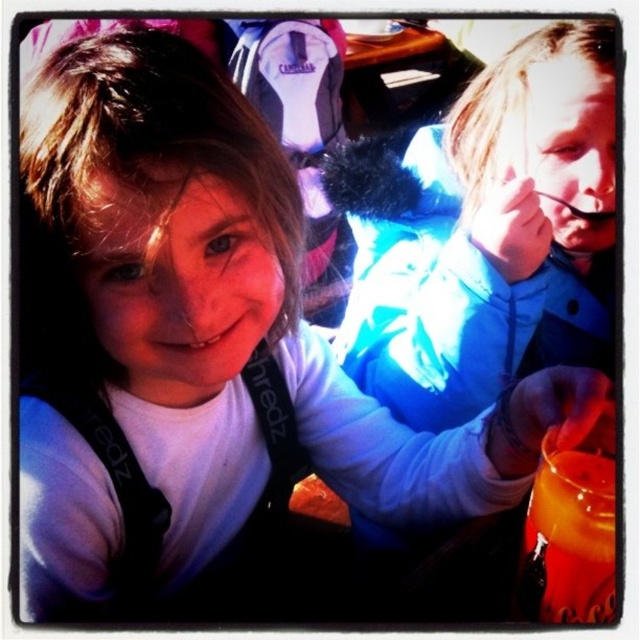
You are a photographer trying to capture a candid shot of the two children in the scene. You notice the blue softshell jacket at upper right and the orange liquid at lower right. Which object is positioned to the right side of the other?

The blue softshell jacket at upper right is positioned to the right of orange liquid at lower right.

You are a photographer trying to capture a shot of the orange liquid at lower right without the blue softshell jacket at upper right blocking the view. Based on their positions, is this possible?

The blue softshell jacket at upper right is above the orange liquid at lower right, so it is blocking the view. To capture the orange liquid at lower right without obstruction, you would need to adjust your angle or position to avoid the jacket.

You are a photographer trying to capture a shot of the blue softshell jacket at upper right and the orange liquid at lower right. Which object should you focus on first if you want to ensure both are in the frame without moving the camera?

You should focus on the blue softshell jacket at upper right first because it is larger in size than the orange liquid at lower right, making it easier to center in the frame before adjusting for the smaller object.